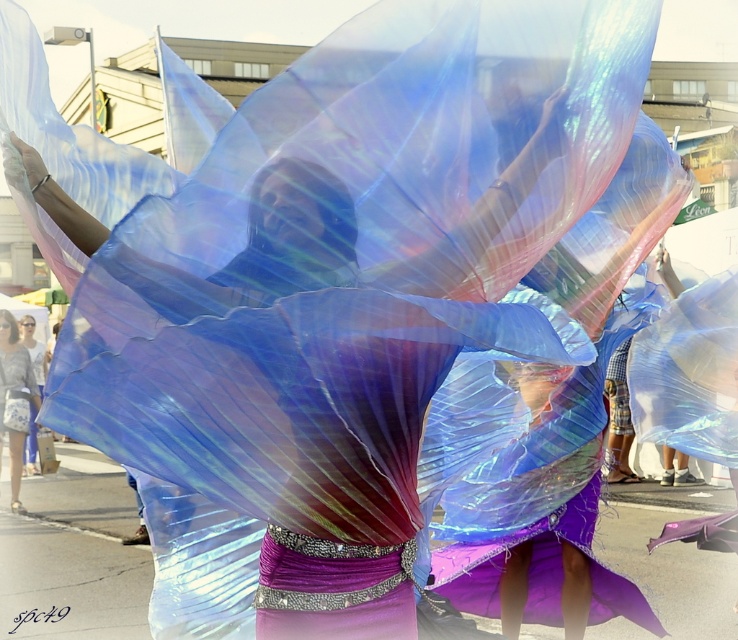
You are a photographer trying to capture the iridescent fabric wings at center in your shot. The camera you are using has a focus point at coordinate point (292,385). Is this focus point correctly positioned to capture the iridescent fabric wings at center?

Yes, the focus point at coordinate point (292,385) is correctly positioned because the point indicates the location of the iridescent fabric wings at center.

You are a photographer trying to capture the iridescent fabric wings at center. The camera has a focal point at coordinate point 0.5, 0.5. Will the wings be in focus if you focus at the center of the image?

The iridescent fabric wings at center are located at point (x=292, y=385), which is slightly to the right and below the camera focal point at (x=369, y=320). Therefore, the wings may not be in focus if focusing at the center.

You are a photographer trying to capture the iridescent fabric wings at center and the matte gray shirt at lower left in the same frame. Which object should you focus on first if you want to ensure both are in focus, considering their sizes?

The iridescent fabric wings at center is smaller than the matte gray shirt at lower left. To ensure both are in focus, focus on the smaller object first, which is the iridescent fabric wings at center, as smaller objects require a narrower depth of field.